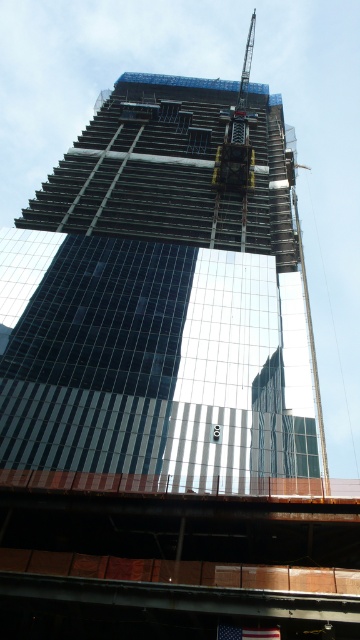
Question: Is glassy reflective skyscraper at center thinner than metallic gray crane at upper center?

Choices:
 (A) no
 (B) yes

Answer: (A)

Question: Can you confirm if glassy reflective skyscraper at center is positioned to the left of metallic gray crane at upper center?

Choices:
 (A) yes
 (B) no

Answer: (A)

Question: Which point is farther to the camera?

Choices:
 (A) (204, 152)
 (B) (221, 173)

Answer: (A)

Question: Is glassy reflective skyscraper at center further to camera compared to metallic gray crane at upper center?

Choices:
 (A) yes
 (B) no

Answer: (B)

Question: Which of the following is the farthest from the observer?

Choices:
 (A) glassy reflective skyscraper at center
 (B) metallic gray crane at upper center

Answer: (B)